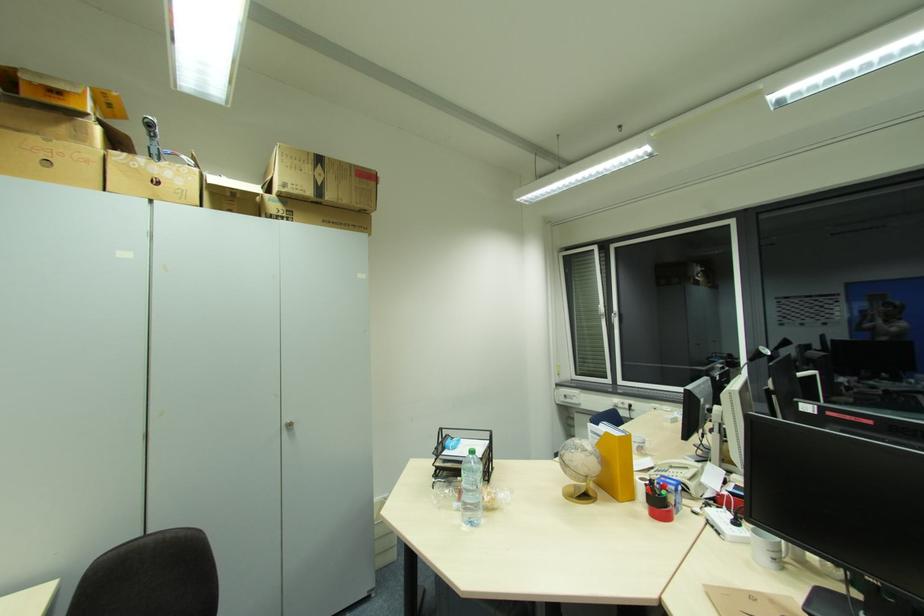
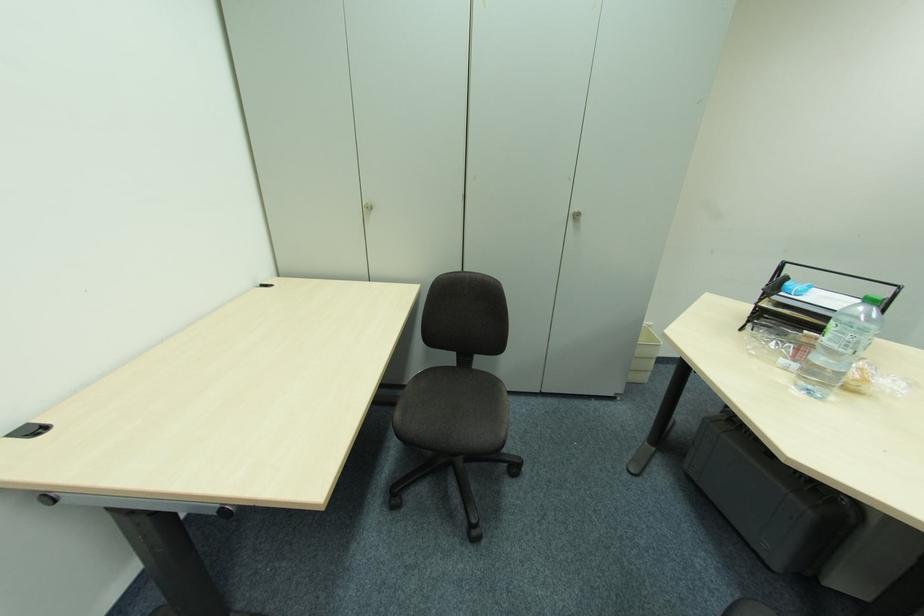
Where in the second image is the point corresponding to point (286, 430) from the first image?

(574, 219)